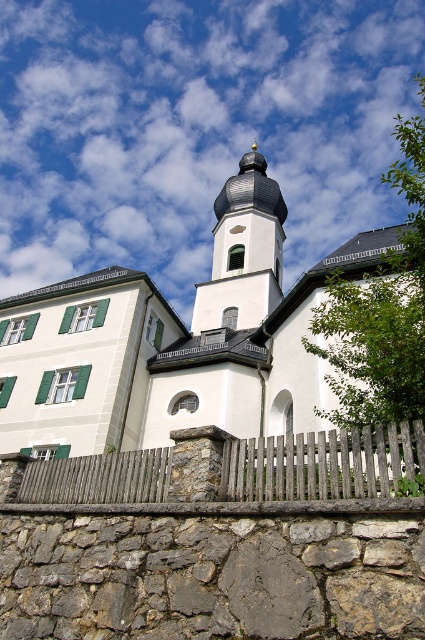
You are a photographer planning to capture the white stone church at upper center and the white stone tower at center in a single frame. Given that the camera can only focus on one object clearly at a time, which object should you prioritize to ensure it fills the frame adequately?

The white stone church at upper center should be prioritized because it has a larger size compared to the white stone tower at center, ensuring it fills the frame adequately when focused on.

You are standing at the center of the image and want to locate the white stone church at upper center. According to the coordinates provided, in which direction should you look to find it?

The white stone church at upper center is located at coordinates point (190, 371). Since you are at the center, you should look upward to find it because the y coordinate 0.449 is above the central point.

You are standing in front of the white building with the dome. You notice a wooden picket fence at lower center and a white stone tower at center. Which object is closer to you from your current viewpoint?

The wooden picket fence at lower center is closer to you because it is positioned under the white stone tower at center, indicating it is in a lower, more forward position.